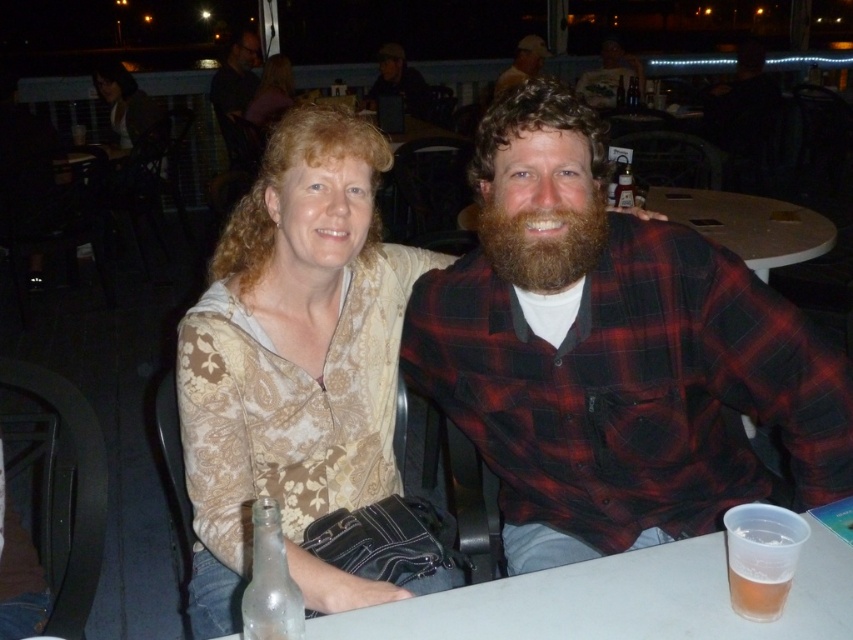
Question: Can you confirm if flannel shirt at center is bigger than matte beige blouse at upper left?

Choices:
 (A) no
 (B) yes

Answer: (A)

Question: Estimate the real-world distances between objects in this image. Which object is farther from the dark brown hair at upper left?

Choices:
 (A) matte purple shirt at upper center
 (B) matte white cap at upper center

Answer: (B)

Question: Is brown fuzzy beard at center to the left of matte white cap at upper center from the viewer's perspective?

Choices:
 (A) no
 (B) yes

Answer: (B)

Question: Does clear glass bottle at lower left appear on the left side of matte beige blouse at upper left?

Choices:
 (A) yes
 (B) no

Answer: (B)

Question: Which point appears closest to the camera in this image?

Choices:
 (A) (265, 381)
 (B) (599, 93)

Answer: (A)

Question: Estimate the real-world distances between objects in this image. Which object is farther from the brown fuzzy beard at center?

Choices:
 (A) clear plastic cup at lower center
 (B) translucent plastic cup at lower right
 (C) clear glass bottle at lower left
 (D) bearded man at center

Answer: (D)